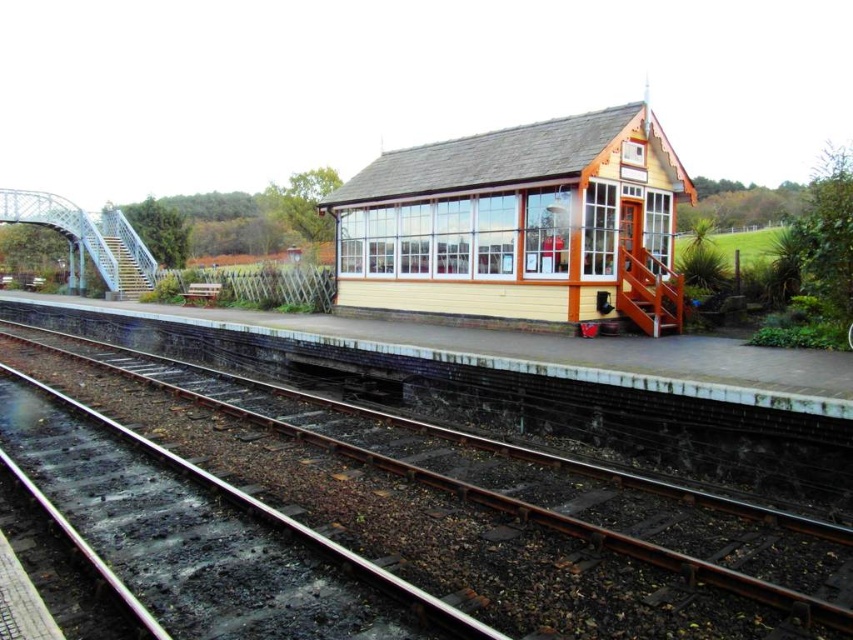
Can you confirm if smooth metal tracks at center is smaller than yellow wood cabin at center?

Indeed, smooth metal tracks at center has a smaller size compared to yellow wood cabin at center.

Between smooth metal tracks at center and yellow wood cabin at center, which one has more height?

yellow wood cabin at center is taller.

Is point (303, 461) more distant than point (405, 310)?

That is False.

The image size is (853, 640). I want to click on smooth metal tracks at center, so click(x=476, y=509).